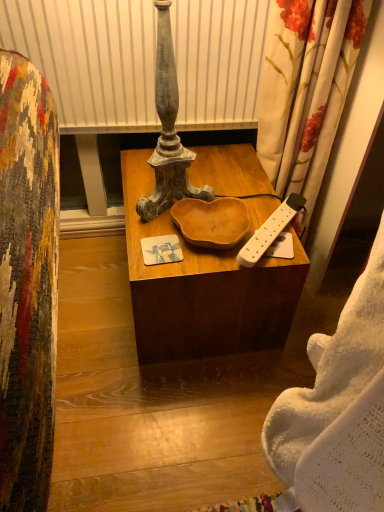
Question: Can you confirm if white knitted blanket at right is thinner than wooden bowl at center?

Choices:
 (A) no
 (B) yes

Answer: (B)

Question: Is white knitted blanket at right not within wooden bowl at center?

Choices:
 (A) yes
 (B) no

Answer: (A)

Question: Is white knitted blanket at right placed right next to wooden bowl at center?

Choices:
 (A) no
 (B) yes

Answer: (A)

Question: Is white knitted blanket at right behind wooden bowl at center?

Choices:
 (A) no
 (B) yes

Answer: (A)

Question: From the image's perspective, is white knitted blanket at right beneath wooden bowl at center?

Choices:
 (A) no
 (B) yes

Answer: (B)

Question: Is wooden bowl at center located within white knitted blanket at right?

Choices:
 (A) yes
 (B) no

Answer: (B)

Question: Is white plastic remote control at right thinner than white knitted blanket at right?

Choices:
 (A) no
 (B) yes

Answer: (B)

Question: Can you confirm if white plastic remote control at right is positioned to the right of white knitted blanket at right?

Choices:
 (A) no
 (B) yes

Answer: (A)

Question: From the image's perspective, is white plastic remote control at right below white knitted blanket at right?

Choices:
 (A) yes
 (B) no

Answer: (B)

Question: Can you confirm if white plastic remote control at right is shorter than white knitted blanket at right?

Choices:
 (A) yes
 (B) no

Answer: (A)

Question: Does white plastic remote control at right have a smaller size compared to white knitted blanket at right?

Choices:
 (A) no
 (B) yes

Answer: (B)

Question: Would you say white plastic remote control at right is a long distance from white knitted blanket at right?

Choices:
 (A) yes
 (B) no

Answer: (B)

Question: Is there a large distance between wooden bowl at center and white knitted blanket at right?

Choices:
 (A) yes
 (B) no

Answer: (B)